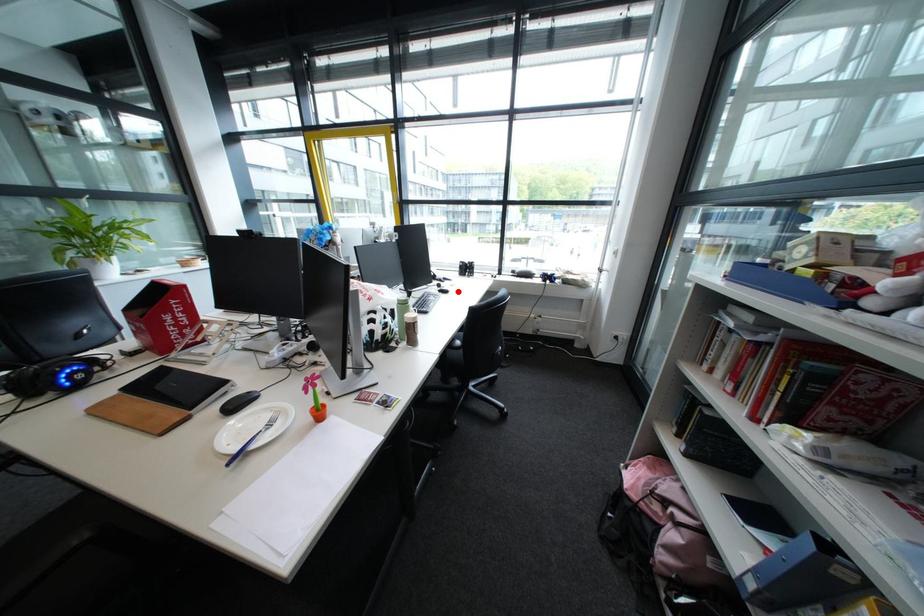
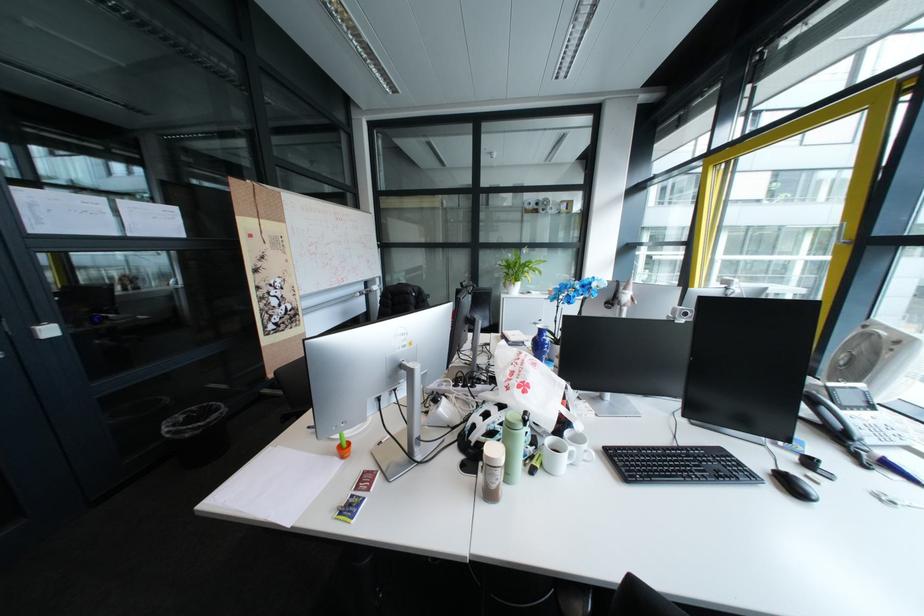
In the second image, find the point that corresponds to the highlighted location in the first image.

(805, 487)